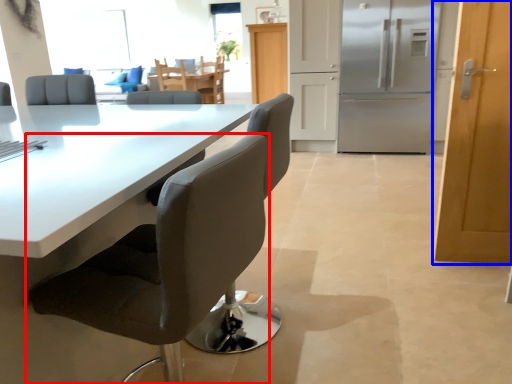
Question: Which of the following is the closest to the observer, chair (highlighted by a red box) or door (highlighted by a blue box)?

Choices:
 (A) chair
 (B) door

Answer: (A)